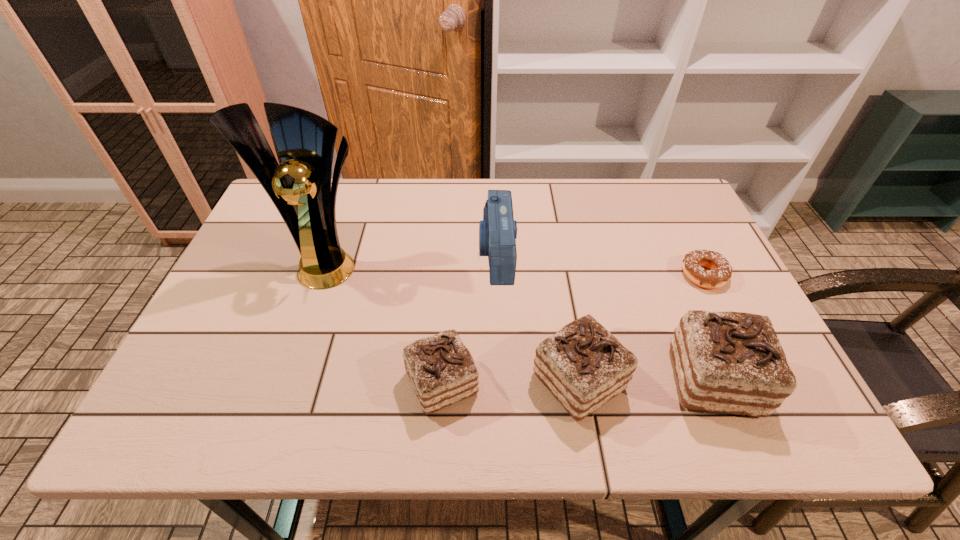
With all chocolate cakes evenly spaced, where should an extra chocolate cake be placed on the left to continue the pattern? Please point out a vacant space. Please provide its 2D coordinates. Your answer should be formatted as a tuple, i.e. [(x, y)], where the tuple contains the x and y coordinates of a point satisfying the conditions above.

[(305, 384)]